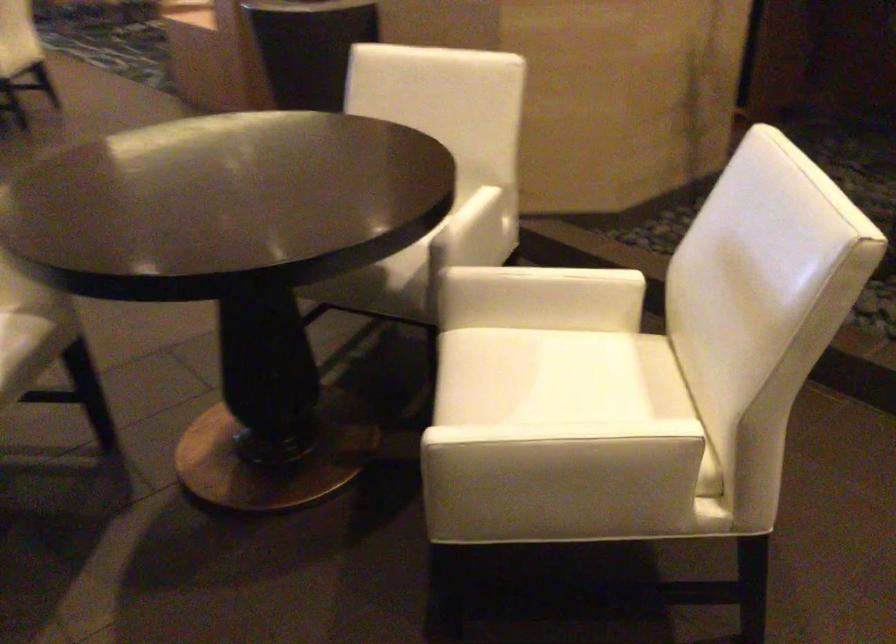
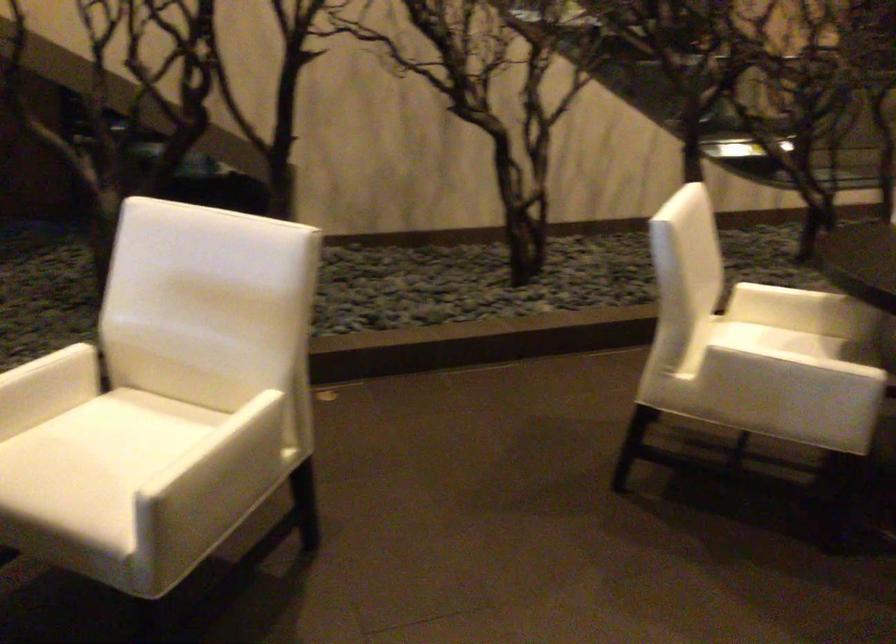
Find the pixel in the second image that matches point 550,460 in the first image.

(225, 462)